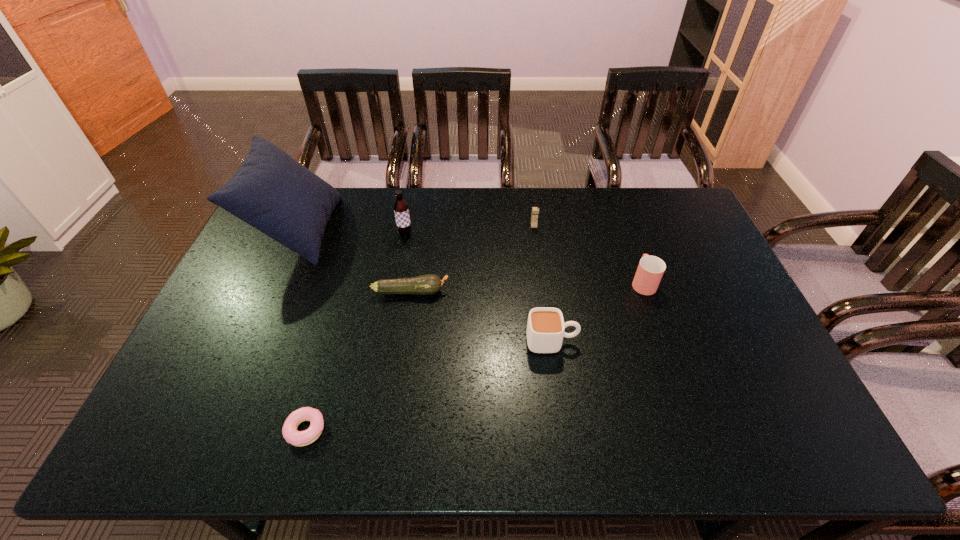
In order to click on free spot at the near right corner of the desktop in this screenshot , I will do `click(804, 437)`.

Locate an element on the screen. unoccupied position between the zucchini and the cushion is located at coordinates (354, 260).

Image resolution: width=960 pixels, height=540 pixels. In order to click on free point between the leftmost object and the doughnut in this screenshot , I will do `click(301, 330)`.

Find the location of `free space between the root beer and the leftmost object`. free space between the root beer and the leftmost object is located at coordinates (351, 232).

Image resolution: width=960 pixels, height=540 pixels. Identify the location of free area in between the nearer cup and the nearest object. (429, 386).

In order to click on free space between the left cup and the second object from left to right in this screenshot , I will do `click(429, 386)`.

This screenshot has width=960, height=540. Find the location of `unoccupied area between the cellular telephone and the farther cup`. unoccupied area between the cellular telephone and the farther cup is located at coordinates (588, 254).

The width and height of the screenshot is (960, 540). Identify the location of free point between the shortest object and the left cup. (429, 386).

Locate an element on the screen. This screenshot has height=540, width=960. free area in between the shortest object and the sixth tallest object is located at coordinates (359, 361).

Identify the location of vacant space that's between the root beer and the rightmost object. (524, 259).